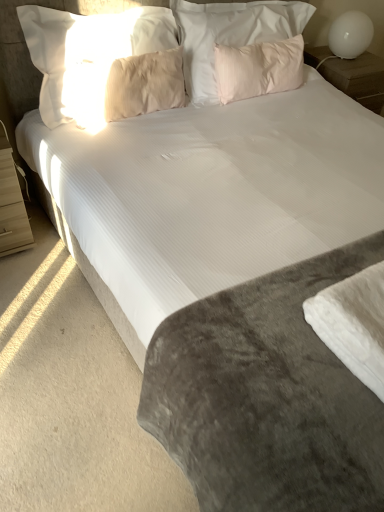
Question: Does pink soft pillow at upper center, which appears as the 4th pillow when viewed from the left, appear on the left side of beige soft pillow at upper center, the fourth pillow in the right-to-left sequence?

Choices:
 (A) no
 (B) yes

Answer: (A)

Question: Is the depth of pink soft pillow at upper center, which appears as the 4th pillow when viewed from the left, greater than that of beige soft pillow at upper center, the fourth pillow in the right-to-left sequence?

Choices:
 (A) no
 (B) yes

Answer: (B)

Question: From a real-world perspective, is pink soft pillow at upper center, marked as the first pillow in a right-to-left arrangement, located higher than beige soft pillow at upper center, the 1th pillow in the left-to-right sequence?

Choices:
 (A) yes
 (B) no

Answer: (B)

Question: Can we say pink soft pillow at upper center, marked as the first pillow in a right-to-left arrangement, lies outside beige soft pillow at upper center, the 1th pillow in the left-to-right sequence?

Choices:
 (A) yes
 (B) no

Answer: (A)

Question: From a real-world perspective, is pink soft pillow at upper center, marked as the first pillow in a right-to-left arrangement, positioned under beige soft pillow at upper center, the 1th pillow in the left-to-right sequence, based on gravity?

Choices:
 (A) yes
 (B) no

Answer: (A)

Question: Does pink soft pillow at upper center, which appears as the 4th pillow when viewed from the left, have a lesser height compared to beige soft pillow at upper center, the fourth pillow in the right-to-left sequence?

Choices:
 (A) no
 (B) yes

Answer: (B)

Question: Is white glossy nightstand at upper right, the 2th nightstand ordered from the bottom, at the left side of pink soft pillow at upper center, marked as the first pillow in a right-to-left arrangement?

Choices:
 (A) no
 (B) yes

Answer: (A)

Question: Is the depth of white glossy nightstand at upper right, which is the 1th nightstand in right-to-left order, less than that of pink soft pillow at upper center, marked as the first pillow in a right-to-left arrangement?

Choices:
 (A) yes
 (B) no

Answer: (B)

Question: Does white glossy nightstand at upper right, the first nightstand viewed from the top, have a lesser width compared to pink soft pillow at upper center, marked as the first pillow in a right-to-left arrangement?

Choices:
 (A) yes
 (B) no

Answer: (B)

Question: Can you confirm if white glossy nightstand at upper right, the 2th nightstand ordered from the bottom, is smaller than pink soft pillow at upper center, marked as the first pillow in a right-to-left arrangement?

Choices:
 (A) no
 (B) yes

Answer: (A)

Question: Is white glossy nightstand at upper right, which is the 1th nightstand in right-to-left order, wider than pink soft pillow at upper center, marked as the first pillow in a right-to-left arrangement?

Choices:
 (A) no
 (B) yes

Answer: (B)

Question: From a real-world perspective, does white glossy nightstand at upper right, which is the 1th nightstand in right-to-left order, stand above pink soft pillow at upper center, marked as the first pillow in a right-to-left arrangement?

Choices:
 (A) yes
 (B) no

Answer: (B)

Question: Could you tell me if white glossy table lamp at upper right is turned towards white glossy nightstand at upper right, positioned as the 2th nightstand in front-to-back order?

Choices:
 (A) no
 (B) yes

Answer: (A)